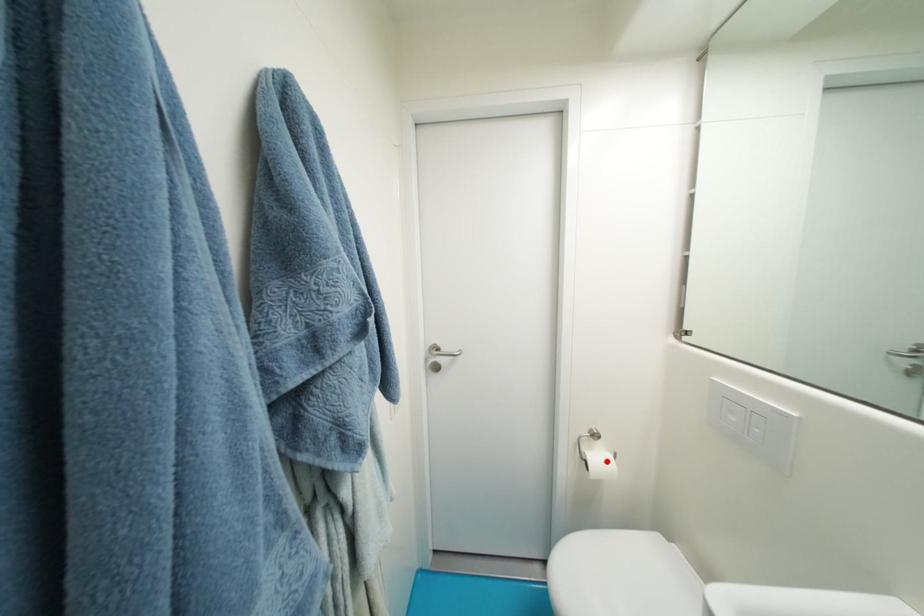
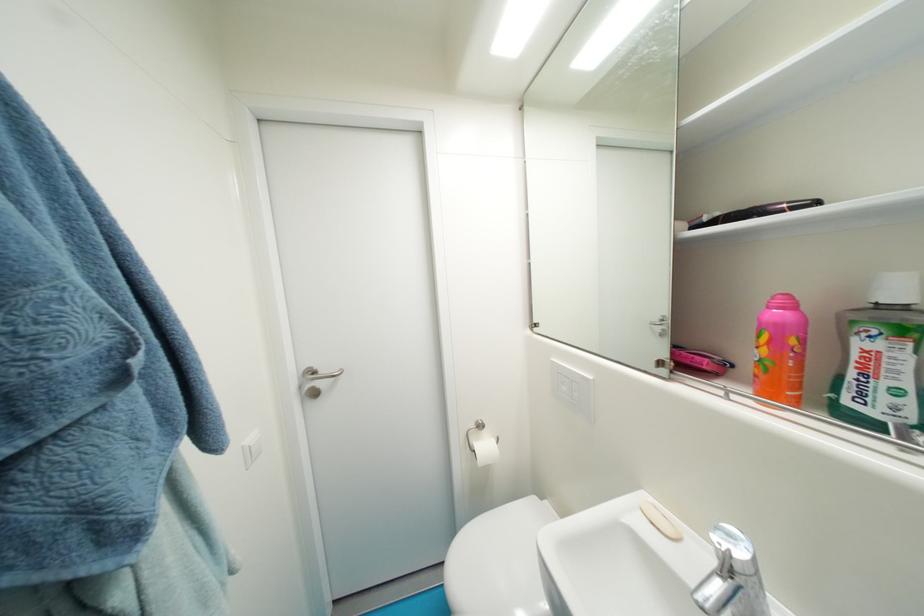
In the second image, find the point that corresponds to the highlighted location in the first image.

(492, 448)